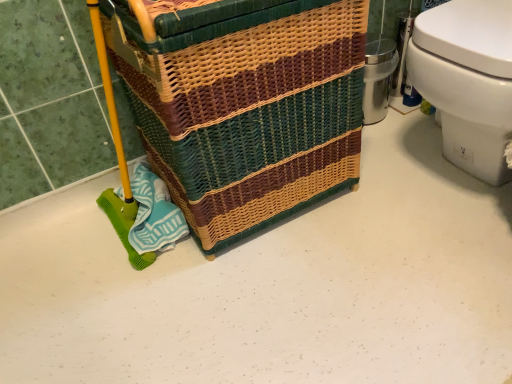
This screenshot has width=512, height=384. I want to click on free area in between woven wicker basket at center and white glossy toilet at right, so click(374, 189).